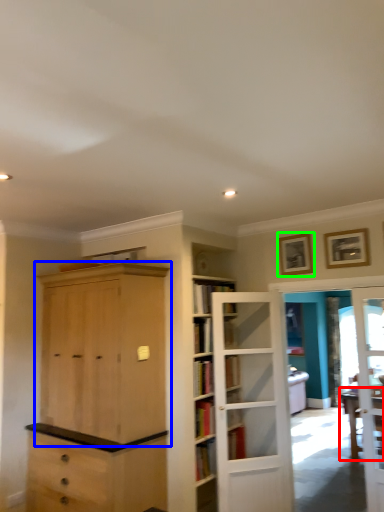
Question: Which is nearer to the table (highlighted by a red box)? cabinetry (highlighted by a blue box) or picture frame (highlighted by a green box).

Choices:
 (A) cabinetry
 (B) picture frame

Answer: (B)